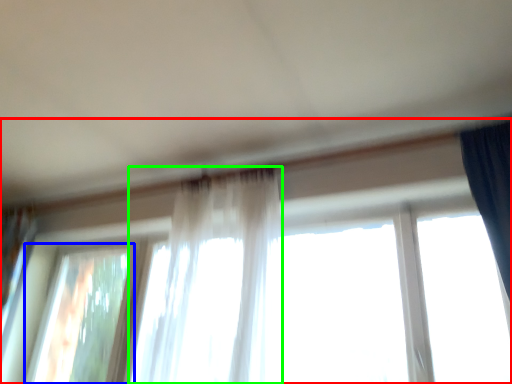
Question: Which object is the farthest from window (highlighted by a red box)? Choose among these: window (highlighted by a blue box) or curtain (highlighted by a green box).

Choices:
 (A) window
 (B) curtain

Answer: (B)